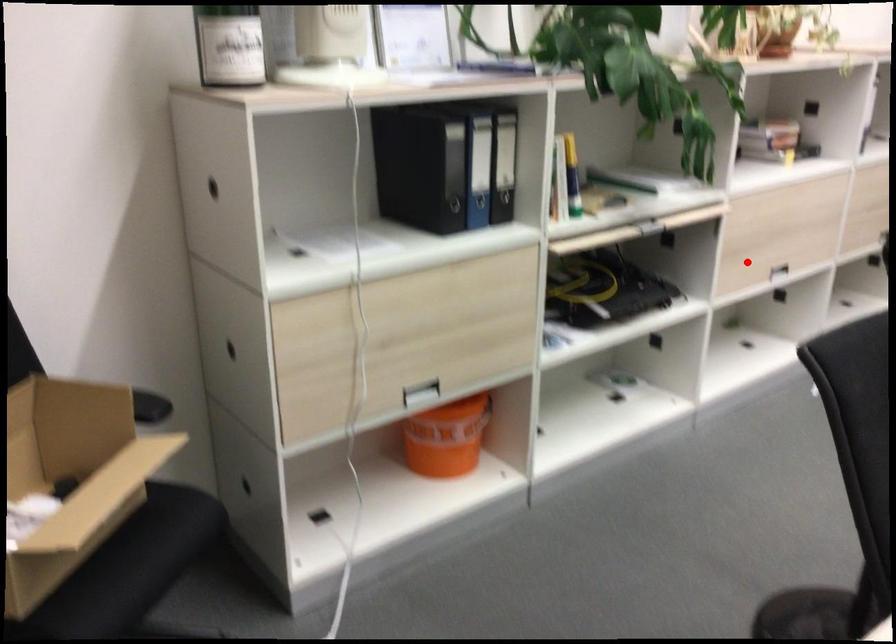
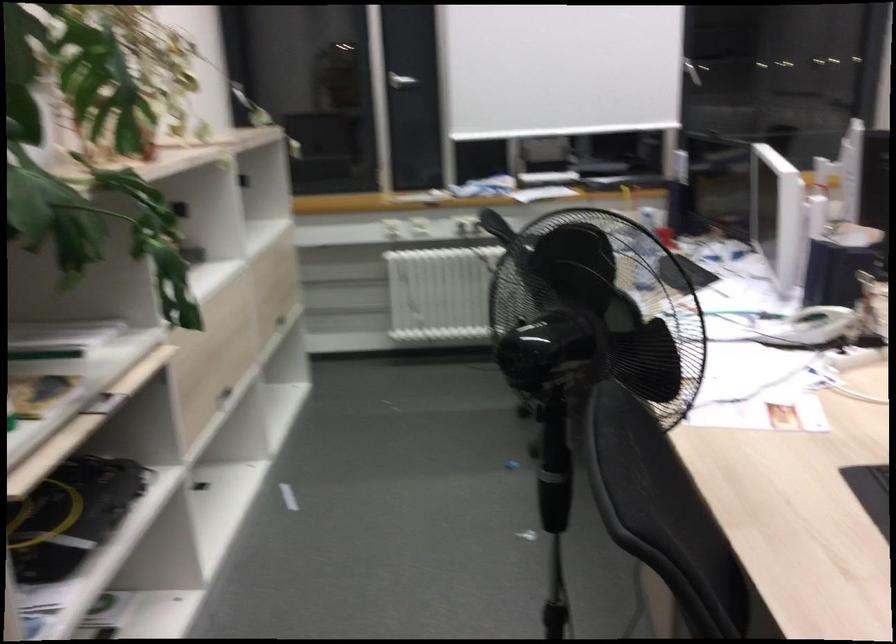
Question: I am providing you with two images of the same scene from different viewpoints. A red point is shown in image1. For the corresponding object point in image2, is it positioned nearer or farther from the camera?

Choices:
 (A) Nearer
 (B) Farther

Answer: (A)